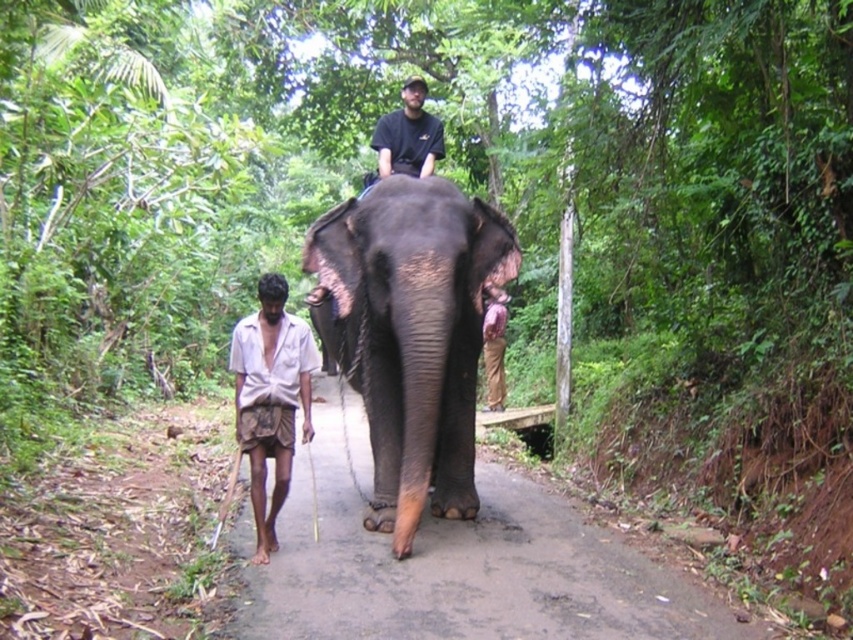
Does white clothed man at left have a smaller size compared to black matte shirt at center?

No, white clothed man at left is not smaller than black matte shirt at center.

Who is positioned more to the right, white clothed man at left or black matte shirt at center?

From the viewer's perspective, black matte shirt at center appears more on the right side.

Identify the location of white clothed man at left. The height and width of the screenshot is (640, 853). (270, 397).

Can you confirm if brown dirt path at center is thinner than black matte shirt at center?

No, brown dirt path at center is not thinner than black matte shirt at center.

Does brown dirt path at center have a smaller size compared to black matte shirt at center?

Correct, brown dirt path at center occupies less space than black matte shirt at center.

Is point (569, 538) farther from camera compared to point (427, 173)?

No.

At what (x,y) coordinates should I click in order to perform the action: click on brown dirt path at center. Please return your answer as a coordinate pair (x, y). The image size is (853, 640). Looking at the image, I should click on (463, 568).

Which is below, brown dirt path at center or white clothed man at left?

brown dirt path at center is below.

Find the location of a particular element. brown dirt path at center is located at coordinates (463, 568).